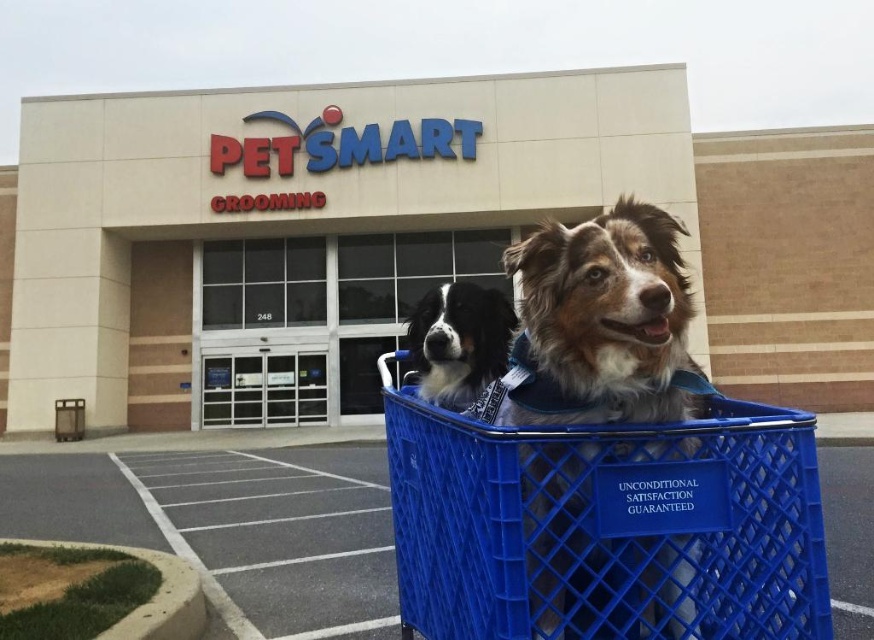
Question: Can you confirm if beige concrete building at center is bigger than black and white fur at center?

Choices:
 (A) yes
 (B) no

Answer: (A)

Question: Which of these objects is positioned farthest from the blue plastic basket at center?

Choices:
 (A) black and white fur at center
 (B) beige concrete building at center

Answer: (B)

Question: Which object is closer to the camera taking this photo?

Choices:
 (A) brown and white fur at center
 (B) beige concrete building at center

Answer: (A)

Question: Can you confirm if blue plastic basket at center is wider than brown and white fur at center?

Choices:
 (A) no
 (B) yes

Answer: (B)

Question: Which of the following is the farthest from the observer?

Choices:
 (A) black and white fur at center
 (B) beige concrete building at center

Answer: (B)

Question: Considering the relative positions of blue plastic basket at center and black and white fur at center in the image provided, where is blue plastic basket at center located with respect to black and white fur at center?

Choices:
 (A) left
 (B) right

Answer: (A)